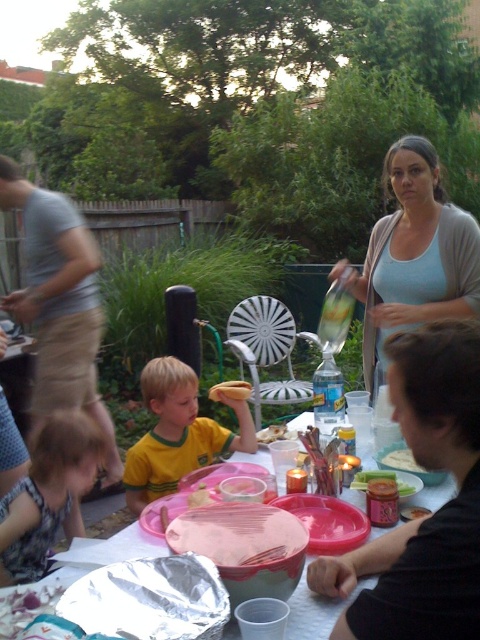
How much distance is there between pink plastic plate at center and golden crispy bread at center?

48.77 centimeters

Who is more forward, (261, 488) or (277, 440)?

Point (261, 488) is more forward.

Identify the location of pink plastic plate at center. Image resolution: width=480 pixels, height=640 pixels. (241, 486).

Based on the photo, who is more distant from viewer, [453,294] or [410,452]?

Positioned behind is point [453,294].

Does point (458, 228) come farther from viewer compared to point (398, 449)?

That is True.

Which is in front, point (414, 310) or point (397, 458)?

Positioned in front is point (397, 458).

Locate an element on the screen. The width and height of the screenshot is (480, 640). light blue cotton tank top at center is located at coordinates (416, 253).

Is light blue cotton tank top at center positioned before golden crispy bread at center?

No, light blue cotton tank top at center is behind golden crispy bread at center.

Between light blue cotton tank top at center and golden crispy bread at center, which one is positioned lower?

golden crispy bread at center is below.

The image size is (480, 640). What do you see at coordinates (416, 253) in the screenshot? I see `light blue cotton tank top at center` at bounding box center [416, 253].

I want to click on light blue cotton tank top at center, so click(x=416, y=253).